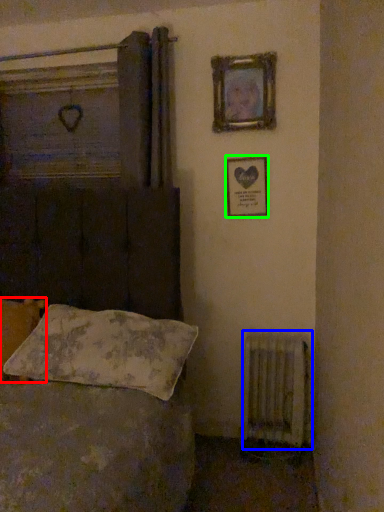
Question: Based on their relative distances, which object is nearer to pillow (highlighted by a red box)? Choose from radiator (highlighted by a blue box) and picture frame (highlighted by a green box).

Choices:
 (A) radiator
 (B) picture frame

Answer: (B)